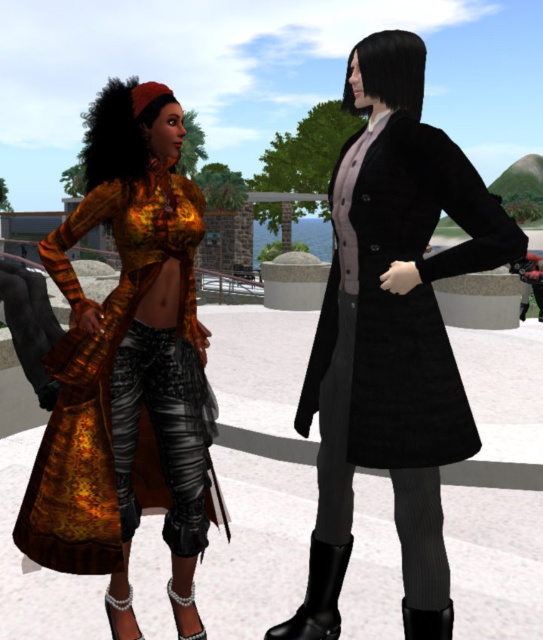
In the scene shown: Is black velvet coat at center positioned at the back of black leather boot at lower center?

No, it is not.

Consider the image. Between black velvet coat at center and black leather boot at lower center, which one has less height?

black leather boot at lower center

Which is behind, point (365, 262) or point (432, 620)?

The point (365, 262) is behind.

At what (x,y) coordinates should I click in order to perform the action: click on black velvet coat at center. Please return your answer as a coordinate pair (x, y). The image size is (543, 640). Looking at the image, I should click on (390, 328).

Can you confirm if black leather boot at lower center is positioned to the right of pearl-embellished boot at lower left?

Indeed, black leather boot at lower center is positioned on the right side of pearl-embellished boot at lower left.

Does black leather boot at lower center appear over pearl-embellished boot at lower left?

Indeed, black leather boot at lower center is positioned over pearl-embellished boot at lower left.

Locate an element on the screen. The height and width of the screenshot is (640, 543). black leather boot at lower center is located at coordinates (427, 621).

Which is in front, point (346, 474) or point (337, 573)?

Point (337, 573)

Is black velvet coat at center thinner than black leather boot at lower right?

No, black velvet coat at center is not thinner than black leather boot at lower right.

Measure the distance between black velvet coat at center and camera.

black velvet coat at center is 7.90 feet away from camera.

Find the location of a particular element. This screenshot has width=543, height=640. black velvet coat at center is located at coordinates (390, 328).